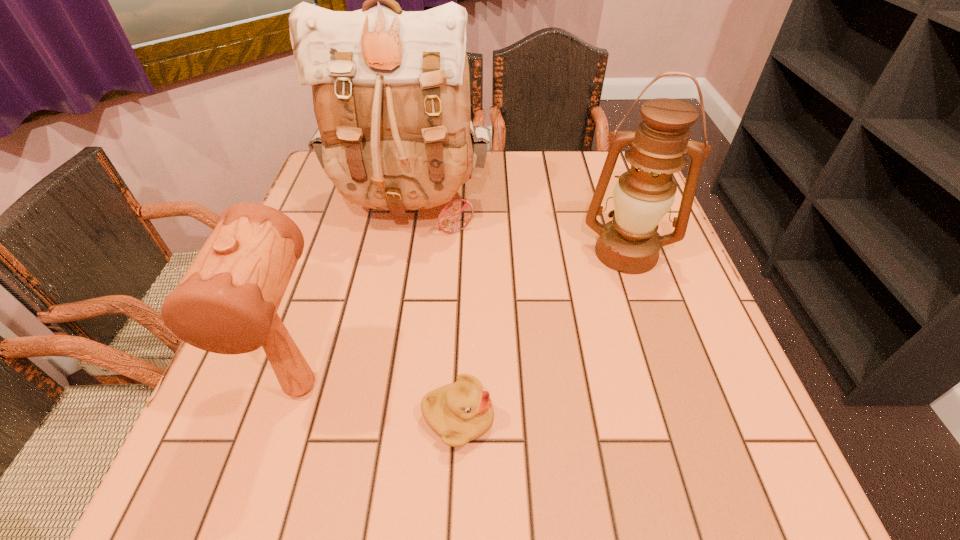
Identify the location of mallet that is positioned at the near edge. (227, 302).

Locate an element on the screen. duckling present at the near edge is located at coordinates (459, 412).

The height and width of the screenshot is (540, 960). I want to click on backpack at the left edge, so coord(391,91).

Identify the location of mallet present at the left edge. Image resolution: width=960 pixels, height=540 pixels. (227, 302).

You are a GUI agent. You are given a task and a screenshot of the screen. Output one action in this format:
    pyautogui.click(x=<x>, y=<y>)
    Task: Click on the object located in the right edge section of the desktop
    
    Given the screenshot: What is the action you would take?
    pyautogui.click(x=642, y=198)

This screenshot has height=540, width=960. I want to click on object situated at the far left corner, so click(x=391, y=91).

Find the location of a particular element. The height and width of the screenshot is (540, 960). object at the near left corner is located at coordinates (227, 302).

Locate an element on the screen. The height and width of the screenshot is (540, 960). free space at the far edge is located at coordinates (524, 185).

The image size is (960, 540). In the image, there is a desktop. What are the coordinates of `free space at the near edge` in the screenshot? It's located at (518, 447).

You are a GUI agent. You are given a task and a screenshot of the screen. Output one action in this format:
    pyautogui.click(x=<x>, y=<y>)
    Task: Click on the free location at the left edge
    The height and width of the screenshot is (540, 960).
    Given the screenshot: What is the action you would take?
    pyautogui.click(x=313, y=264)